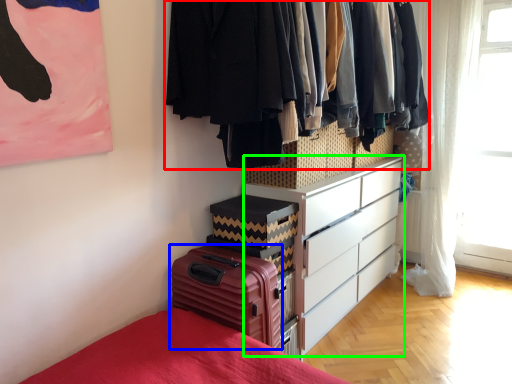
Question: Which object is the closest to the closet (highlighted by a red box)? Choose among these: suitcase (highlighted by a blue box) or chest of drawers (highlighted by a green box).

Choices:
 (A) suitcase
 (B) chest of drawers

Answer: (A)